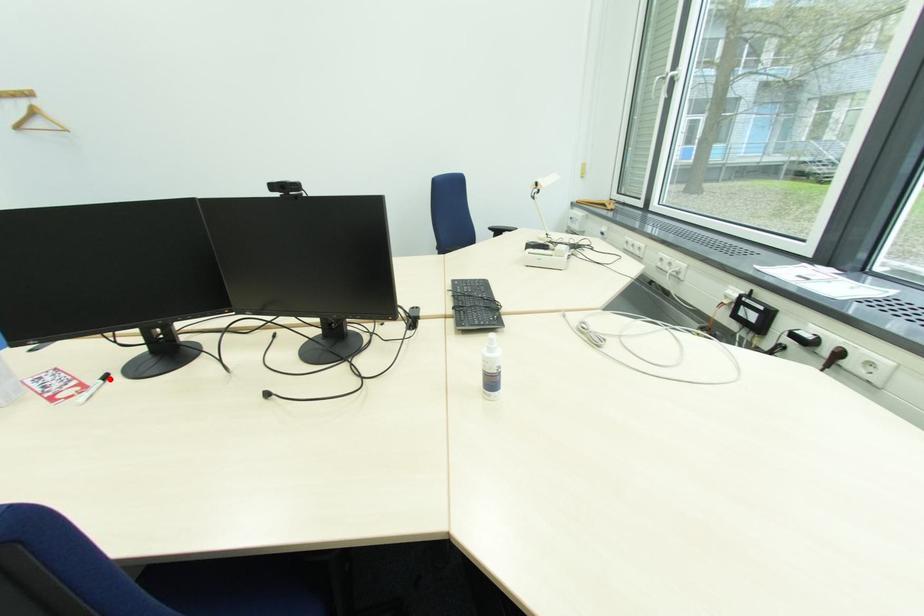
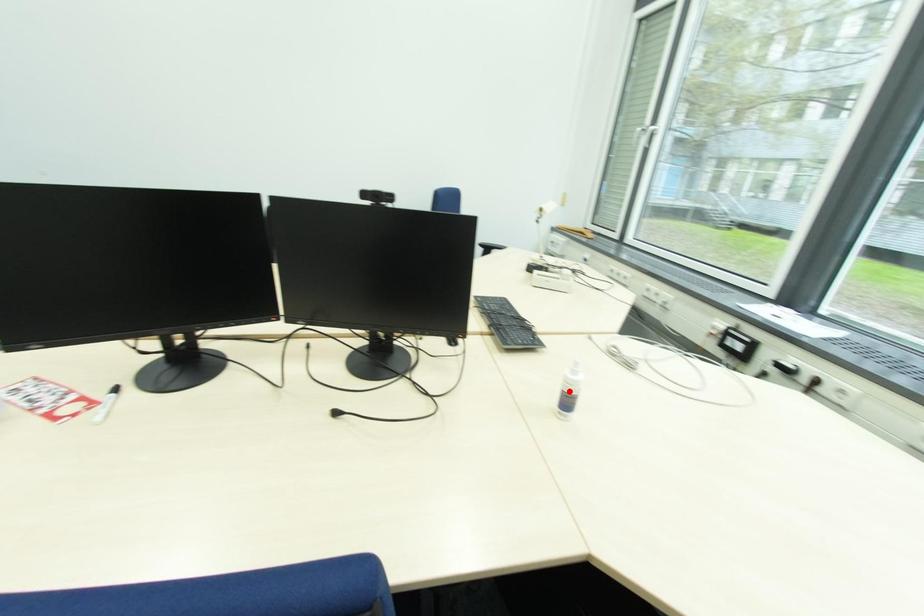
I am providing you with two images of the same scene from different viewpoints. A red point is marked on the first image and another point is marked on the second image. Does the point marked in image1 correspond to the same location as the one in image2?

No